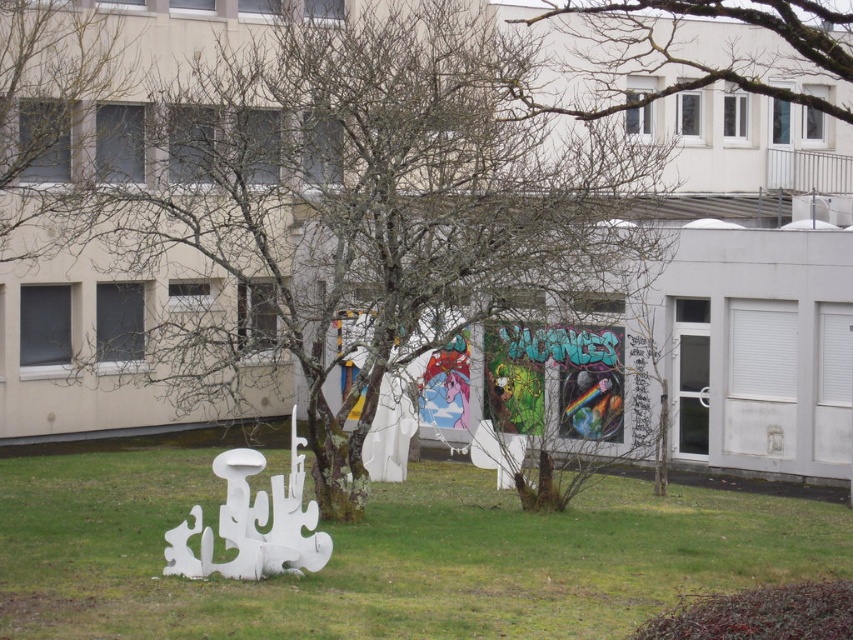
Consider the image. Is green grass at lower center wider than bare branches at upper center?

Yes.

Who is more forward, (660, 504) or (578, 17)?

Positioned in front is point (660, 504).

Locate an element on the screen. The height and width of the screenshot is (640, 853). green grass at lower center is located at coordinates (387, 556).

Locate an element on the screen. bare branches at center is located at coordinates (368, 209).

Which is behind, point (508, 180) or point (39, 586)?

Positioned behind is point (508, 180).

Identify the location of bare branches at center. (368, 209).

Is point (62, 129) positioned before point (683, 52)?

Yes, point (62, 129) is in front of point (683, 52).

Is point (50, 180) positioned before point (606, 3)?

Yes.

At what (x,y) coordinates should I click in order to perform the action: click on bare branches at upper left. Please return your answer as a coordinate pair (x, y). Looking at the image, I should click on 50,113.